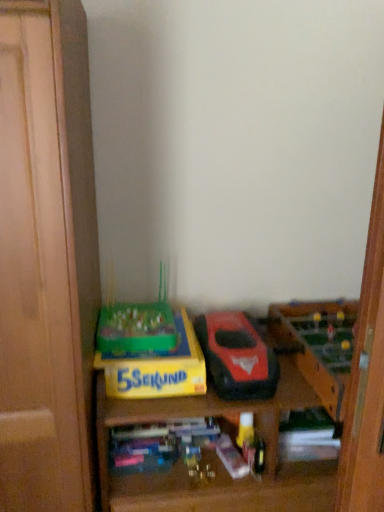
Describe the element at coordinates (214, 454) in the screenshot. The height and width of the screenshot is (512, 384). I see `wooden shelf at lower center` at that location.

Locate an element on the screen. green plastic game at center, which is the first toy in left-to-right order is located at coordinates (137, 326).

Find the location of `yellow cardboard box at lower center`. yellow cardboard box at lower center is located at coordinates (157, 368).

This screenshot has width=384, height=512. I want to click on shiny red plastic toy car at center, so click(237, 356).

At what (x,y) coordinates should I click in order to perform the action: click on wooden shelf at lower center. Please return your answer as a coordinate pair (x, y). The height and width of the screenshot is (512, 384). Looking at the image, I should click on (214, 454).

Which of these two, shiny red plastic toy car at center or wooden foosball table at right, the 2th toy viewed from the left, is bigger?

With larger size is wooden foosball table at right, the 2th toy viewed from the left.

Can you confirm if shiny red plastic toy car at center is positioned to the left of wooden foosball table at right, the 2th toy viewed from the left?

Yes.

Find the location of a particular element. The image size is (384, 512). model car that is on the left side of wooden foosball table at right, marked as the first toy in a right-to-left arrangement is located at coordinates (237, 356).

Could you measure the distance between shiny red plastic toy car at center and wooden foosball table at right, the 2th toy viewed from the left?

7.63 inches.

From a real-world perspective, is yellow cardboard box at lower center under green plastic game at center, positioned as the second toy in right-to-left order?

Indeed, from a real-world perspective, yellow cardboard box at lower center is positioned beneath green plastic game at center, positioned as the second toy in right-to-left order.

From the image's perspective, is yellow cardboard box at lower center positioned above or below green plastic game at center, positioned as the second toy in right-to-left order?

Based on their image positions, yellow cardboard box at lower center is located beneath green plastic game at center, positioned as the second toy in right-to-left order.

Which of these two, yellow cardboard box at lower center or green plastic game at center, positioned as the second toy in right-to-left order, stands taller?

With more height is green plastic game at center, positioned as the second toy in right-to-left order.

Is wooden foosball table at right, marked as the first toy in a right-to-left arrangement, far away from yellow cardboard box at lower center?

They are positioned close to each other.

From a real-world perspective, is wooden foosball table at right, marked as the first toy in a right-to-left arrangement, physically located above or below yellow cardboard box at lower center?

wooden foosball table at right, marked as the first toy in a right-to-left arrangement, is above yellow cardboard box at lower center.

Is the position of wooden foosball table at right, marked as the first toy in a right-to-left arrangement, less distant than that of yellow cardboard box at lower center?

Yes, it is.

Does point (337, 384) lie behind point (125, 377)?

No, it is not.

Is shiny red plastic toy car at center a part of green plastic game at center, positioned as the second toy in right-to-left order?

Actually, shiny red plastic toy car at center is outside green plastic game at center, positioned as the second toy in right-to-left order.

From a real-world perspective, between green plastic game at center, which is the first toy in left-to-right order, and shiny red plastic toy car at center, who is vertically lower?

shiny red plastic toy car at center is physically lower.

Relative to shiny red plastic toy car at center, is green plastic game at center, which is the first toy in left-to-right order, in front or behind?

In the image, green plastic game at center, which is the first toy in left-to-right order, appears behind shiny red plastic toy car at center.

What's the angular difference between shiny red plastic toy car at center and wooden shelf at lower center's facing directions?

They differ by 0.239 degrees in their facing directions.

Visually, is shiny red plastic toy car at center positioned to the left or to the right of wooden shelf at lower center?

Based on their positions, shiny red plastic toy car at center is located to the left of wooden shelf at lower center.

Considering the sizes of objects shiny red plastic toy car at center and wooden shelf at lower center in the image provided, who is bigger, shiny red plastic toy car at center or wooden shelf at lower center?

With larger size is wooden shelf at lower center.

Based on the photo, measure the distance between shiny red plastic toy car at center and wooden shelf at lower center.

shiny red plastic toy car at center is 6.16 inches away from wooden shelf at lower center.

Looking at the image, does shiny red plastic toy car at center seem bigger or smaller compared to green plastic game at center, which is the first toy in left-to-right order?

shiny red plastic toy car at center is smaller than green plastic game at center, which is the first toy in left-to-right order.

From the image's perspective, is shiny red plastic toy car at center over green plastic game at center, positioned as the second toy in right-to-left order?

Actually, shiny red plastic toy car at center appears below green plastic game at center, positioned as the second toy in right-to-left order, in the image.

Could you tell me if shiny red plastic toy car at center is turned towards green plastic game at center, positioned as the second toy in right-to-left order?

No, shiny red plastic toy car at center is not facing towards green plastic game at center, positioned as the second toy in right-to-left order.

Is wooden shelf at lower center at the back of yellow cardboard box at lower center?

Yes.

Image resolution: width=384 pixels, height=512 pixels. I want to click on shelf below the yellow cardboard box at lower center (from the image's perspective), so click(x=214, y=454).

Does yellow cardboard box at lower center lie behind wooden shelf at lower center?

Yes, yellow cardboard box at lower center is further from the viewer.

Locate an element on the screen. The image size is (384, 512). toy located in front of the shiny red plastic toy car at center is located at coordinates (319, 345).

From the image's perspective, starting from the yellow cardboard box at lower center, which toy is the 2nd one above? Please provide its 2D coordinates.

[(137, 326)]

Looking at the image, which one is located further to wooden foosball table at right, marked as the first toy in a right-to-left arrangement, green plastic game at center, which is the first toy in left-to-right order, or yellow cardboard box at lower center?

Among the two, green plastic game at center, which is the first toy in left-to-right order, is located further to wooden foosball table at right, marked as the first toy in a right-to-left arrangement.

Which object lies further to the anchor point green plastic game at center, which is the first toy in left-to-right order, yellow cardboard box at lower center or shiny red plastic toy car at center?

Among the two, shiny red plastic toy car at center is located further to green plastic game at center, which is the first toy in left-to-right order.

Which object lies further to the anchor point shiny red plastic toy car at center, wooden shelf at lower center or yellow cardboard box at lower center?

wooden shelf at lower center lies further to shiny red plastic toy car at center than the other object.

Based on their spatial positions, is yellow cardboard box at lower center or wooden foosball table at right, the 2th toy viewed from the left, further from shiny red plastic toy car at center?

The object further to shiny red plastic toy car at center is wooden foosball table at right, the 2th toy viewed from the left.

In the scene shown: Looking at the image, which one is located further to wooden foosball table at right, marked as the first toy in a right-to-left arrangement, green plastic game at center, which is the first toy in left-to-right order, or wooden shelf at lower center?

green plastic game at center, which is the first toy in left-to-right order, is positioned further to the anchor wooden foosball table at right, marked as the first toy in a right-to-left arrangement.

Looking at the image, which one is located closer to shiny red plastic toy car at center, wooden foosball table at right, the 2th toy viewed from the left, or wooden shelf at lower center?

wooden shelf at lower center.

Looking at the image, which one is located further to wooden foosball table at right, marked as the first toy in a right-to-left arrangement, wooden shelf at lower center or green plastic game at center, which is the first toy in left-to-right order?

green plastic game at center, which is the first toy in left-to-right order, is positioned further to the anchor wooden foosball table at right, marked as the first toy in a right-to-left arrangement.

Considering their positions, is wooden foosball table at right, the 2th toy viewed from the left, positioned further to green plastic game at center, positioned as the second toy in right-to-left order, than shiny red plastic toy car at center?

Among the two, wooden foosball table at right, the 2th toy viewed from the left, is located further to green plastic game at center, positioned as the second toy in right-to-left order.

Identify the location of cardboard box between shiny red plastic toy car at center and wooden shelf at lower center vertically. The height and width of the screenshot is (512, 384). (157, 368).

Identify the location of shelf between yellow cardboard box at lower center and wooden foosball table at right, the 2th toy viewed from the left, from left to right. Image resolution: width=384 pixels, height=512 pixels. (214, 454).

I want to click on model car between green plastic game at center, positioned as the second toy in right-to-left order, and wooden shelf at lower center vertically, so click(x=237, y=356).

Locate an element on the screen. cardboard box between green plastic game at center, positioned as the second toy in right-to-left order, and wooden foosball table at right, marked as the first toy in a right-to-left arrangement, from left to right is located at coordinates (157, 368).